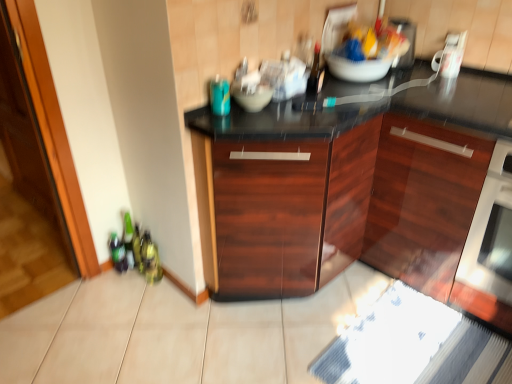
Question: Is mahogany wood cabinet at center, the second cabinetry when ordered from right to left, to the left or to the right of white glossy toaster at upper right in the image?

Choices:
 (A) right
 (B) left

Answer: (B)

Question: Considering the positions of mahogany wood cabinet at center, the 1th cabinetry positioned from the left, and white glossy toaster at upper right in the image, is mahogany wood cabinet at center, the 1th cabinetry positioned from the left, taller or shorter than white glossy toaster at upper right?

Choices:
 (A) short
 (B) tall

Answer: (B)

Question: Which of these objects is positioned closest to the dark wood cabinet at center, acting as the 2th cabinetry starting from the left?

Choices:
 (A) satin white oven at right
 (B) teal glass bottle at upper center
 (C) mahogany wood cabinet at center, the 1th cabinetry positioned from the left
 (D) transparent glass door at left
 (E) matte gray bowl at center

Answer: (C)

Question: Which object is the farthest from the teal glass bottle at upper center?

Choices:
 (A) transparent glass door at left
 (B) matte gray bowl at center
 (C) dark wood cabinet at center, acting as the 2th cabinetry starting from the left
 (D) mahogany wood cabinet at center, the 1th cabinetry positioned from the left
 (E) satin white oven at right

Answer: (A)